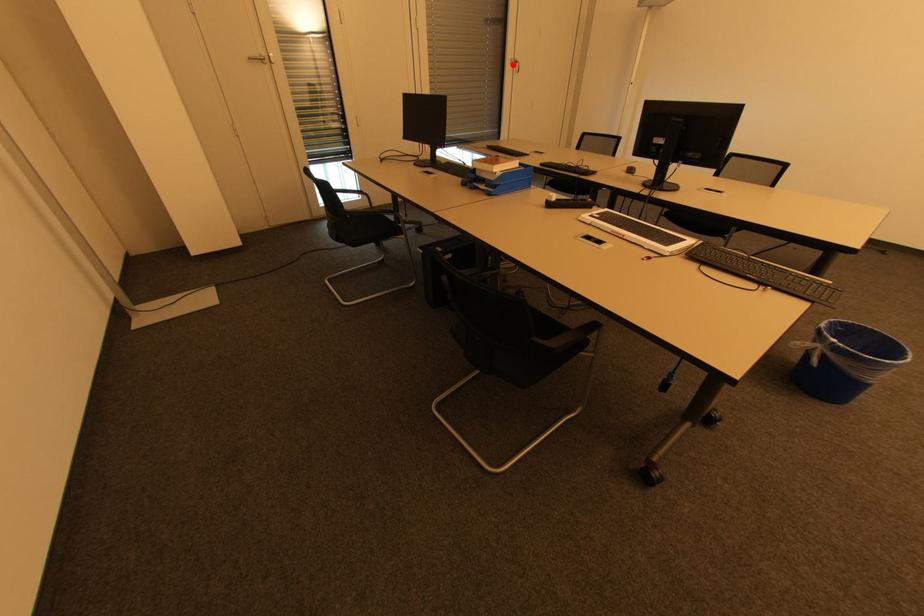
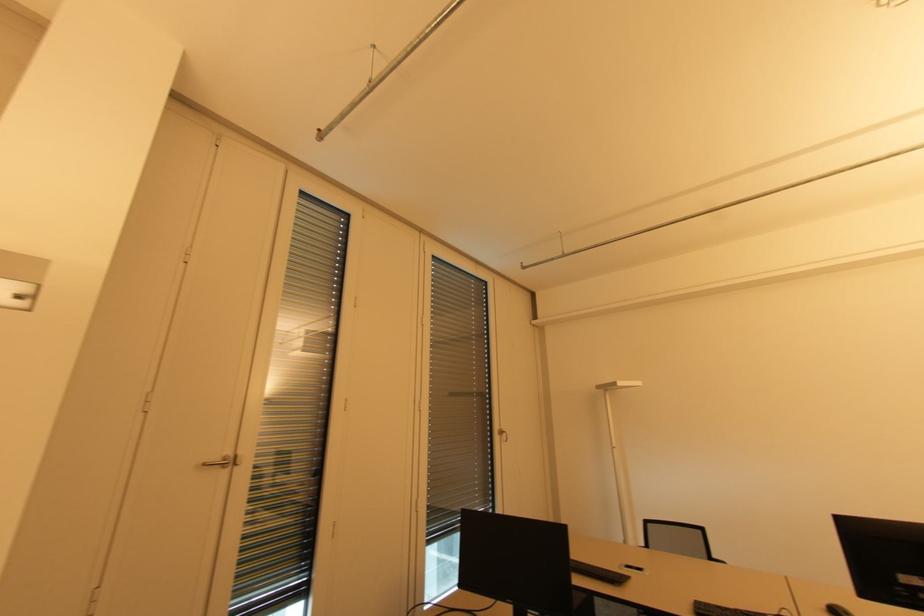
Question: A red point is marked in image1. In image2, is the corresponding 3D point closer to the camera or farther? Reply with the corresponding letter.

Choices:
 (A) The corresponding 3D point is closer.
 (B) The corresponding 3D point is farther.

Answer: (B)